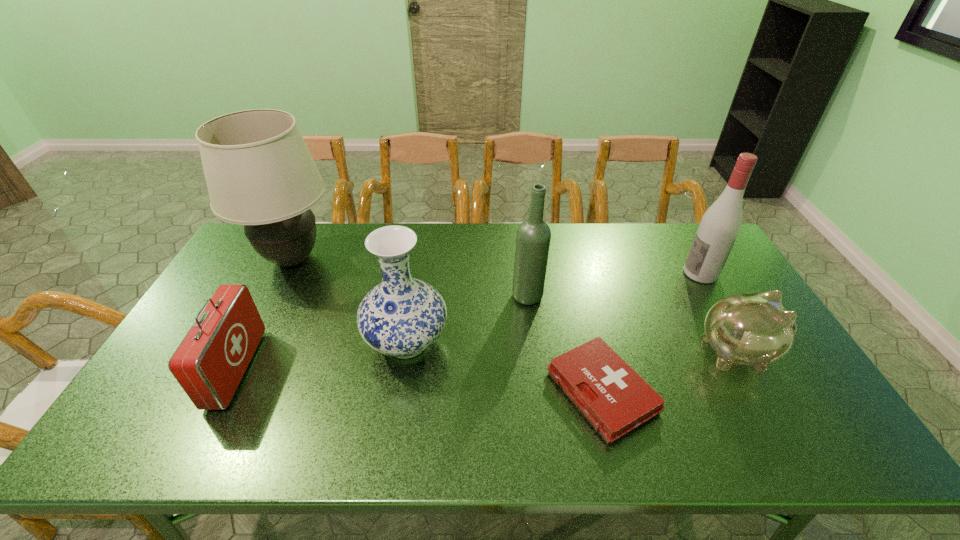
The image size is (960, 540). I want to click on vacant space that's between the vase and the alcohol, so click(554, 308).

The image size is (960, 540). What are the coordinates of `free space that is in between the left first-aid kit and the third object from left to right` in the screenshot? It's located at (322, 356).

This screenshot has width=960, height=540. Find the location of `vacant space that is in between the piggy bank and the taller first-aid kit`. vacant space that is in between the piggy bank and the taller first-aid kit is located at coordinates (487, 361).

Locate an element on the screen. The height and width of the screenshot is (540, 960). vacant space that's between the shorter first-aid kit and the alcohol is located at coordinates (651, 332).

The width and height of the screenshot is (960, 540). I want to click on free area in between the wine bottle and the alcohol, so click(x=614, y=285).

I want to click on vacant space that's between the right first-aid kit and the lampshade, so click(x=447, y=325).

Locate an element on the screen. The image size is (960, 540). free area in between the wine bottle and the third object from left to right is located at coordinates (468, 319).

Locate an element on the screen. free space between the alcohol and the left first-aid kit is located at coordinates (468, 321).

Find the location of a particular element. The height and width of the screenshot is (540, 960). vacant space that is in between the alcohol and the taller first-aid kit is located at coordinates (468, 321).

Identify the location of object that ranks as the fourth closest to the fifth object from right to left. (209, 363).